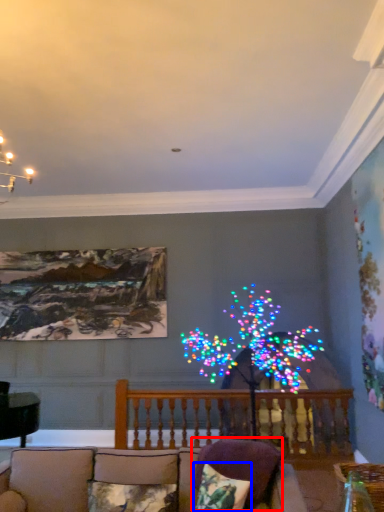
Question: Which object appears closest to the camera in this image, pillow (highlighted by a red box) or pillow (highlighted by a blue box)?

Choices:
 (A) pillow
 (B) pillow

Answer: (B)